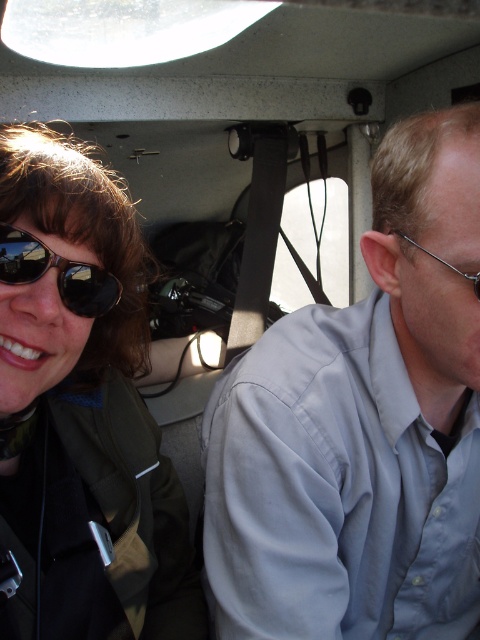
You are a passenger seated in the vehicle and want to reach two points marked in the image. The first point is at coordinate point(90, 266) and the second is at point(479, 289). Which point is closer to you?

Point(90, 266) is closer to you because it is further to the camera than point(479, 289).

You are a delivery robot with a height of 30 inches. You need to place a package on the point at coordinate point (6, 278). Can you reach that point?

The distance of point (6, 278) from camera is 25.31 inches. Since the robot is 30 inches tall, it can reach the point as it is within its height capability.

You are a delivery robot that needs to place a package between the black reflective sunglasses at left and the clear plastic glasses at right. The package is 10 inches long. Can you fit the package between them without moving either pair of glasses?

The distance between the black reflective sunglasses at left and the clear plastic glasses at right is 12.70 inches. Since the package is 10 inches long, it can fit between them as there is enough space.